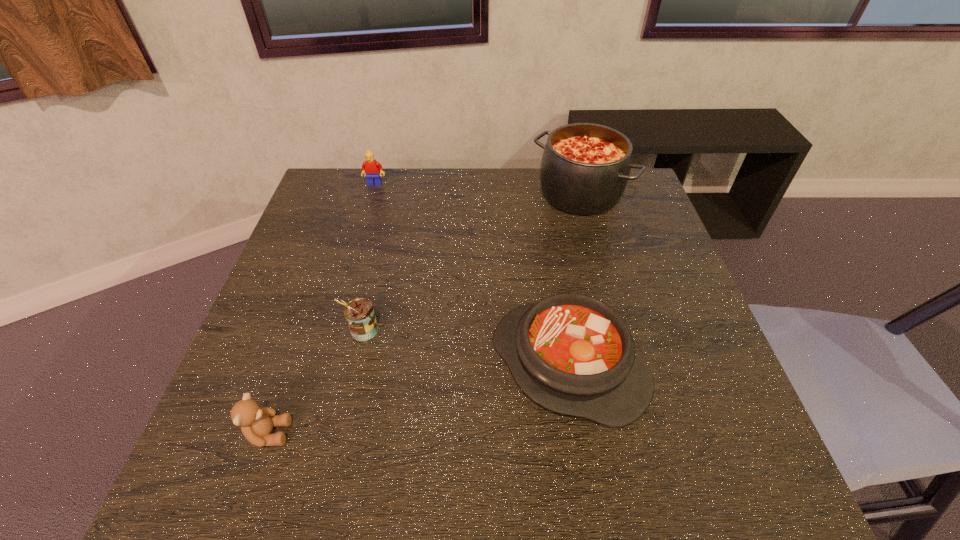
Locate an element on the screen. The width and height of the screenshot is (960, 540). vacant space at the near edge of the desktop is located at coordinates (572, 453).

Locate an element on the screen. vacant space at the left edge is located at coordinates (285, 364).

Where is `vacant area at the right edge`? The image size is (960, 540). vacant area at the right edge is located at coordinates (626, 273).

Where is `blank space at the far left corner`? This screenshot has width=960, height=540. blank space at the far left corner is located at coordinates (345, 197).

You are a GUI agent. You are given a task and a screenshot of the screen. Output one action in this format:
    pyautogui.click(x=<x>, y=<y>)
    Task: Click on the vacant space at the near left corner
    This screenshot has width=960, height=540.
    Given the screenshot: What is the action you would take?
    pyautogui.click(x=261, y=455)

The image size is (960, 540). I want to click on vacant space at the far right corner of the desktop, so click(x=639, y=212).

Where is `vacant space at the near right corner`? vacant space at the near right corner is located at coordinates (706, 468).

Identify the location of empty space between the can and the shorter casserole. (466, 348).

Image resolution: width=960 pixels, height=540 pixels. I want to click on vacant area that lies between the teddy bear and the nearer casserole, so click(419, 399).

The image size is (960, 540). I want to click on vacant area between the shorter casserole and the can, so click(466, 348).